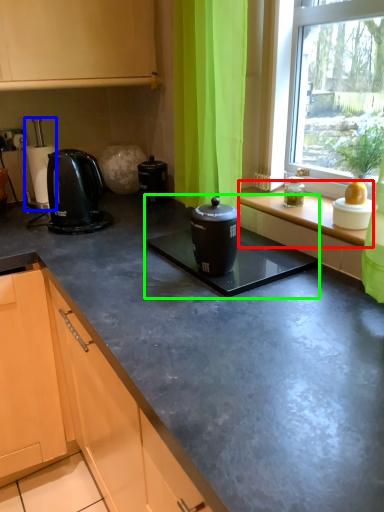
Question: Based on their relative distances, which object is farther from window sill (highlighted by a red box)? Choose from coffee machine (highlighted by a blue box) and sink (highlighted by a green box).

Choices:
 (A) coffee machine
 (B) sink

Answer: (A)